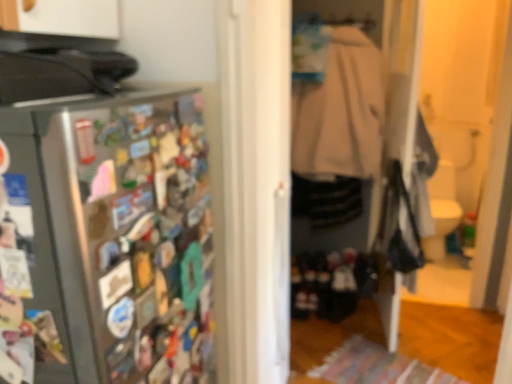
What do you see at coordinates (105, 238) in the screenshot? The image size is (512, 384). I see `satin silver refrigerator at left` at bounding box center [105, 238].

The width and height of the screenshot is (512, 384). Identify the location of satin silver refrigerator at left. (105, 238).

Find the location of `beige fabric coat at center`. beige fabric coat at center is located at coordinates click(x=339, y=135).

In order to face beige fabric coat at center, should I rotate leftwards or rightwards?

It's best to rotate right around 10.254 degrees.

The image size is (512, 384). Describe the element at coordinates (339, 135) in the screenshot. I see `beige fabric coat at center` at that location.

Find the location of `satin silver refrigerator at left`. satin silver refrigerator at left is located at coordinates (105, 238).

Which is more to the left, beige fabric coat at center or satin silver refrigerator at left?

satin silver refrigerator at left is more to the left.

Is beige fabric coat at center positioned in front of satin silver refrigerator at left?

No, beige fabric coat at center is behind satin silver refrigerator at left.

Does point (367, 109) lie in front of point (64, 125)?

That is False.

From the image's perspective, who appears lower, beige fabric coat at center or satin silver refrigerator at left?

satin silver refrigerator at left is shown below in the image.

From a real-world perspective, which object rests below the other?

satin silver refrigerator at left, from a real-world perspective.

Between beige fabric coat at center and satin silver refrigerator at left, which one has smaller width?

beige fabric coat at center.

Between beige fabric coat at center and satin silver refrigerator at left, which one has less height?

satin silver refrigerator at left.

Between beige fabric coat at center and satin silver refrigerator at left, which one has larger size?

satin silver refrigerator at left is bigger.

Can we say beige fabric coat at center lies outside satin silver refrigerator at left?

beige fabric coat at center is positioned outside satin silver refrigerator at left.

Are beige fabric coat at center and satin silver refrigerator at left located far from each other?

Yes, beige fabric coat at center is far from satin silver refrigerator at left.

Could you tell me if beige fabric coat at center is facing satin silver refrigerator at left?

Yes, beige fabric coat at center is oriented towards satin silver refrigerator at left.

Identify the location of refrigerator below the beige fabric coat at center (from a real-world perspective). The height and width of the screenshot is (384, 512). (105, 238).

Can you confirm if satin silver refrigerator at left is positioned to the left of beige fabric coat at center?

Yes.

Does satin silver refrigerator at left come behind beige fabric coat at center?

No, satin silver refrigerator at left is closer to the viewer.

Between point (126, 247) and point (332, 126), which one is positioned in front?

The point (126, 247) is closer.

From the image's perspective, is satin silver refrigerator at left located beneath beige fabric coat at center?

Yes.

From a real-world perspective, does satin silver refrigerator at left stand above beige fabric coat at center?

Actually, satin silver refrigerator at left is physically below beige fabric coat at center in the real world.

Is satin silver refrigerator at left thinner than beige fabric coat at center?

Incorrect, the width of satin silver refrigerator at left is not less than that of beige fabric coat at center.

Can you confirm if satin silver refrigerator at left is shorter than beige fabric coat at center?

Indeed, satin silver refrigerator at left has a lesser height compared to beige fabric coat at center.

Considering the sizes of objects satin silver refrigerator at left and beige fabric coat at center in the image provided, who is bigger, satin silver refrigerator at left or beige fabric coat at center?

satin silver refrigerator at left is bigger.

Do you think satin silver refrigerator at left is within beige fabric coat at center, or outside of it?

satin silver refrigerator at left cannot be found inside beige fabric coat at center.

Are satin silver refrigerator at left and beige fabric coat at center located far from each other?

satin silver refrigerator at left is far away from beige fabric coat at center.

Is satin silver refrigerator at left turned away from beige fabric coat at center?

satin silver refrigerator at left does not have its back to beige fabric coat at center.

How different are the orientations of satin silver refrigerator at left and beige fabric coat at center in degrees?

The facing directions of satin silver refrigerator at left and beige fabric coat at center are 90.8 degrees apart.

The image size is (512, 384). Find the location of `refrigerator lying in front of the beige fabric coat at center`. refrigerator lying in front of the beige fabric coat at center is located at coordinates (105, 238).

At what (x,y) coordinates should I click in order to perform the action: click on clothing behind the satin silver refrigerator at left. Please return your answer as a coordinate pair (x, y). Image resolution: width=512 pixels, height=384 pixels. Looking at the image, I should click on pos(339,135).

Image resolution: width=512 pixels, height=384 pixels. In the image, there is a beige fabric coat at center. Identify the location of refrigerator below it (from the image's perspective). 105,238.